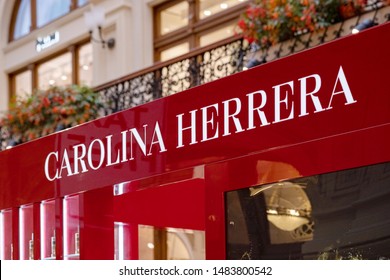
Where is `dark gray slightly curving vertical beam`? The height and width of the screenshot is (280, 390). dark gray slightly curving vertical beam is located at coordinates (255, 220).